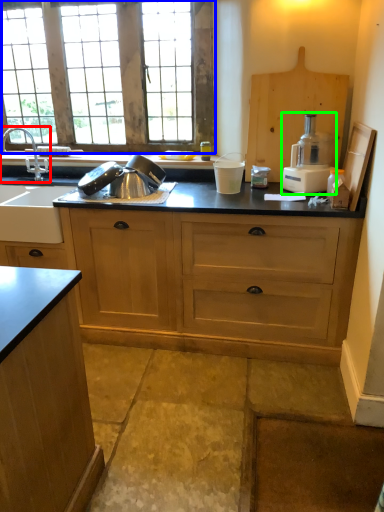
Question: Which object is positioned closest to tap (highlighted by a red box)? Select from window (highlighted by a blue box) and kitchen appliance (highlighted by a green box).

Choices:
 (A) window
 (B) kitchen appliance

Answer: (A)